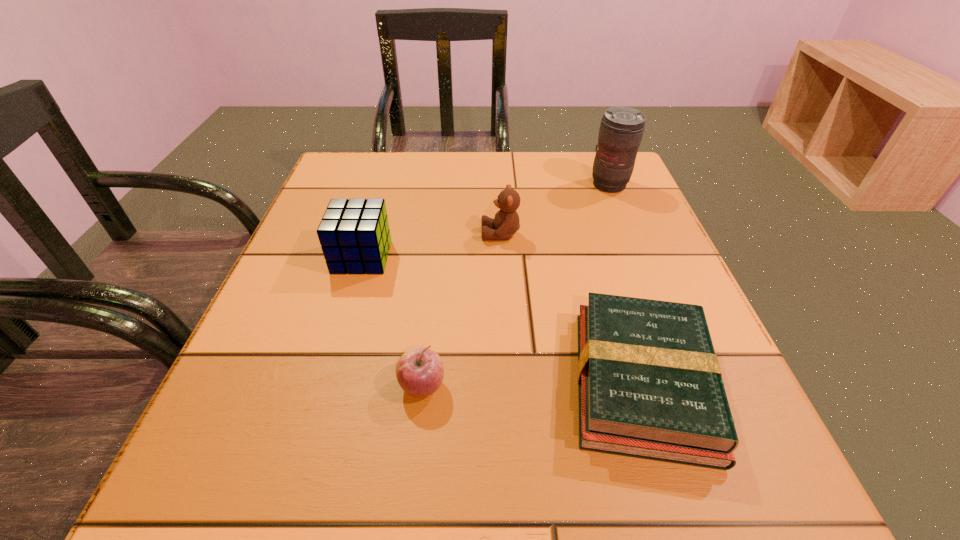
Find the location of a particular element. The width and height of the screenshot is (960, 540). the farthest object is located at coordinates (621, 130).

The width and height of the screenshot is (960, 540). In order to click on telephoto lens in this screenshot , I will do `click(621, 130)`.

Identify the location of the third object from right to left. The width and height of the screenshot is (960, 540). (506, 222).

This screenshot has height=540, width=960. In order to click on cube in this screenshot , I will do `click(354, 234)`.

Where is `the second shortest object`? The image size is (960, 540). the second shortest object is located at coordinates (419, 371).

Identify the location of apple. (419, 371).

This screenshot has width=960, height=540. Identify the location of the shortest object. (650, 386).

This screenshot has height=540, width=960. I want to click on vacant space located on the side of the telephoto lens where the control switches are located, so click(x=643, y=269).

Find the location of a particular element. The height and width of the screenshot is (540, 960). vacant area located 0.090m on the face of the third object from left to right is located at coordinates (439, 234).

You are a GUI agent. You are given a task and a screenshot of the screen. Output one action in this format:
    pyautogui.click(x=<x>, y=<y>)
    Task: Click on the free space located on the face of the third object from left to right
    The width and height of the screenshot is (960, 540).
    Given the screenshot: What is the action you would take?
    pyautogui.click(x=392, y=234)